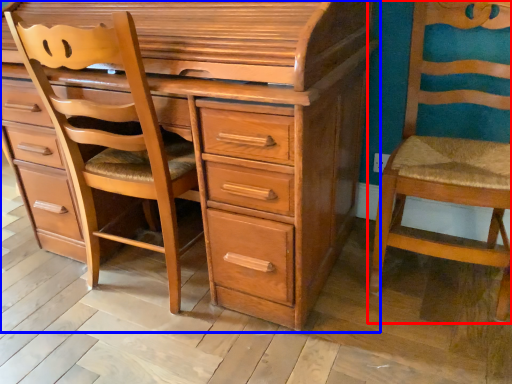
Question: Which of the following is the farthest to the observer, chair (highlighted by a red box) or chest of drawers (highlighted by a blue box)?

Choices:
 (A) chair
 (B) chest of drawers

Answer: (A)